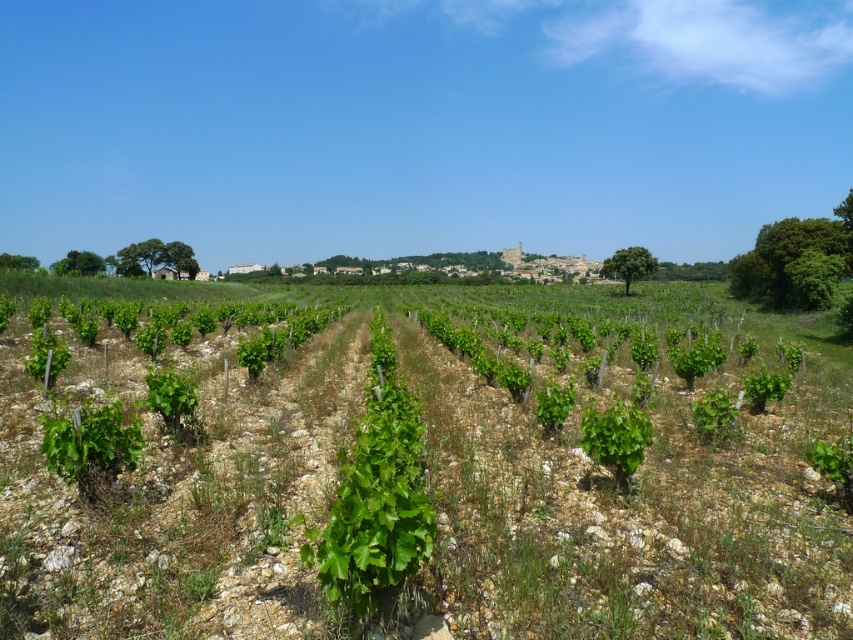
Does green leafy plant at center appear on the right side of green leafy plant at lower left?

Yes, green leafy plant at center is to the right of green leafy plant at lower left.

Is green leafy plant at center bigger than green leafy plant at lower left?

No.

Is point (641, 448) in front of point (166, 403)?

Yes.

Where is `green leafy plant at center`? Image resolution: width=853 pixels, height=640 pixels. green leafy plant at center is located at coordinates (616, 438).